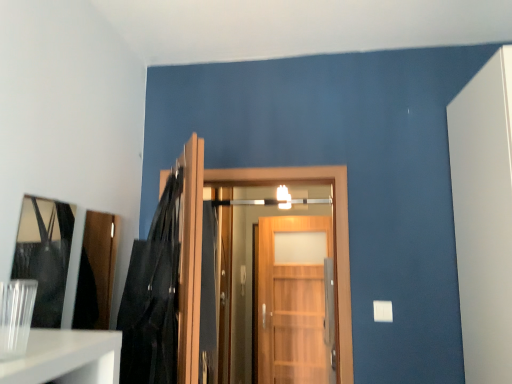
Question: From a real-world perspective, is wooden door at center, placed as the 2th door when sorted from front to back, on top of matte black mirror at left?

Choices:
 (A) yes
 (B) no

Answer: (B)

Question: Is wooden door at center, placed as the 2th door when sorted from front to back, taller than matte black mirror at left?

Choices:
 (A) no
 (B) yes

Answer: (B)

Question: From a real-world perspective, is wooden door at center, placed as the 2th door when sorted from front to back, physically below matte black mirror at left?

Choices:
 (A) no
 (B) yes

Answer: (B)

Question: Considering the relative sizes of wooden door at center, placed as the 2th door when sorted from front to back, and matte black mirror at left in the image provided, is wooden door at center, placed as the 2th door when sorted from front to back, shorter than matte black mirror at left?

Choices:
 (A) yes
 (B) no

Answer: (B)

Question: Does wooden door at center, placed as the 2th door when sorted from front to back, have a greater width compared to matte black mirror at left?

Choices:
 (A) yes
 (B) no

Answer: (A)

Question: Considering the positions of wooden door at center, which is the 2th door from back to front, and black leather jacket at upper left in the image, is wooden door at center, which is the 2th door from back to front, wider or thinner than black leather jacket at upper left?

Choices:
 (A) thin
 (B) wide

Answer: (B)

Question: Considering the positions of point (348, 243) and point (152, 302), is point (348, 243) closer or farther from the camera than point (152, 302)?

Choices:
 (A) closer
 (B) farther

Answer: (B)

Question: Considering their positions, is wooden door at center, placed as the 2th door when sorted from front to back, located in front of or behind black leather jacket at upper left?

Choices:
 (A) behind
 (B) front

Answer: (A)

Question: In terms of size, does wooden door at center, which is the 2th door from back to front, appear bigger or smaller than black leather jacket at upper left?

Choices:
 (A) small
 (B) big

Answer: (B)

Question: Relative to transparent glass vase at lower left, is wooden door at center, which is the 2th door from back to front, in front or behind?

Choices:
 (A) behind
 (B) front

Answer: (A)

Question: Is wooden door at center, which is the 2th door from back to front, wider or thinner than transparent glass vase at lower left?

Choices:
 (A) thin
 (B) wide

Answer: (B)

Question: Visually, is wooden door at center, which is the 2th door from back to front, positioned to the left or to the right of transparent glass vase at lower left?

Choices:
 (A) left
 (B) right

Answer: (B)

Question: Would you say wooden door at center, which is the 2th door from back to front, is inside or outside transparent glass vase at lower left?

Choices:
 (A) outside
 (B) inside

Answer: (A)

Question: In terms of width, does satin silver door handle at center look wider or thinner when compared to wooden door at center, the 1th door from the front?

Choices:
 (A) thin
 (B) wide

Answer: (B)

Question: Is satin silver door handle at center situated inside wooden door at center, the 1th door from the front, or outside?

Choices:
 (A) outside
 (B) inside

Answer: (A)